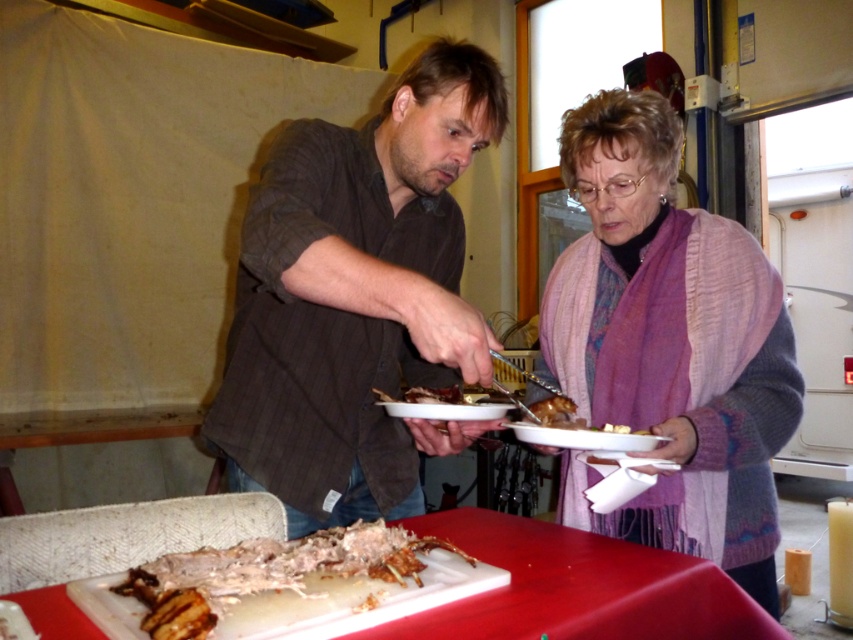
You are a guest at the event and want to take a photo of the knitted purple scarf at center and the white plastic cutting board at lower center. Which object should you focus on first to ensure both are in the frame?

You should focus on the knitted purple scarf at center first because it is closer to you than the white plastic cutting board at lower center, ensuring both are in the frame.

You are a photographer taking a closeup shot of the two people at the center of the scene. The matte brown shirt at center and the knitted purple scarf at center are both in your frame. If your camera has a focus range of 3 inches, will both items stay in focus?

The matte brown shirt at center and the knitted purple scarf at center are 3.58 inches apart from each other. Since the distance between them exceeds the camera focus range of 3 inches, both items may not stay in focus simultaneously.